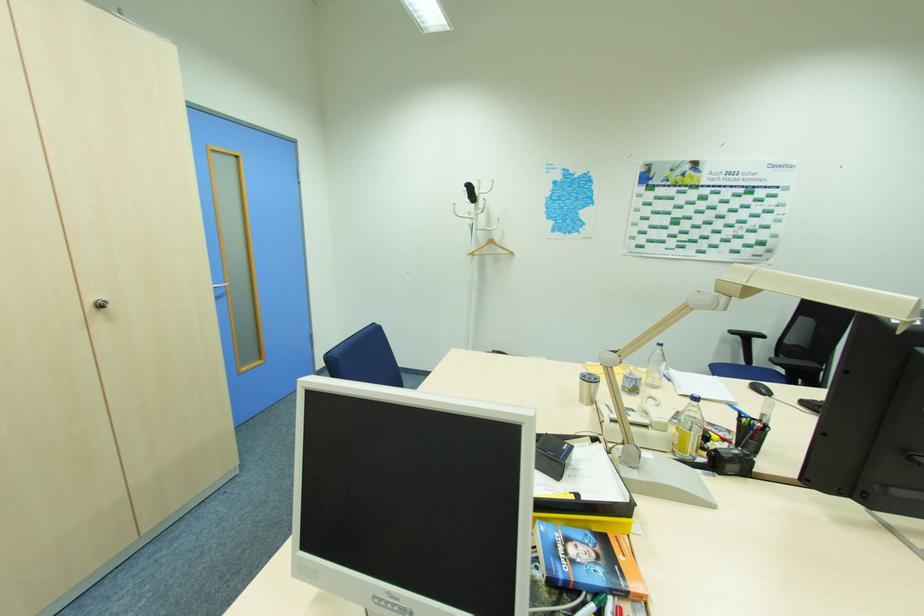
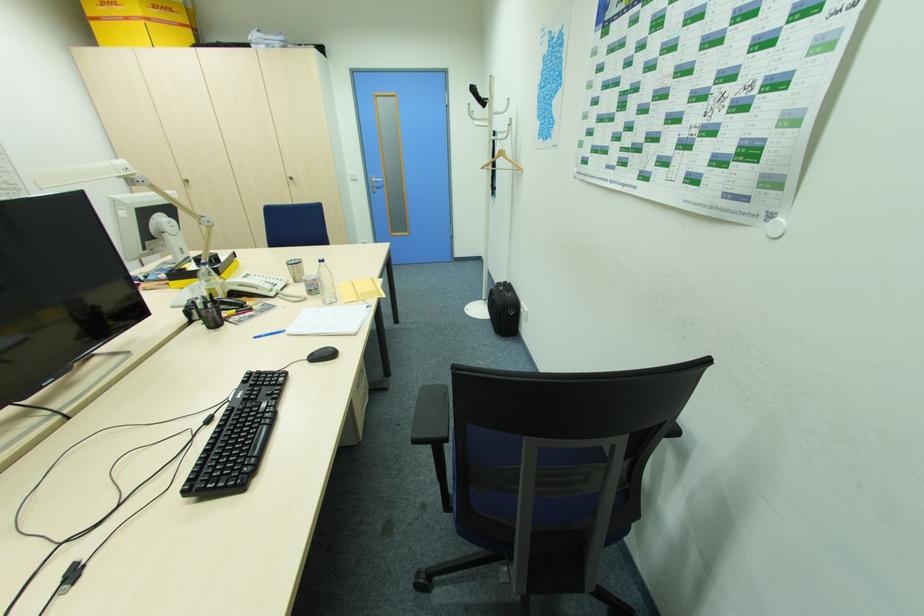
Where in the second image is the point corresponding to the point at 663,347 from the first image?

(324, 264)